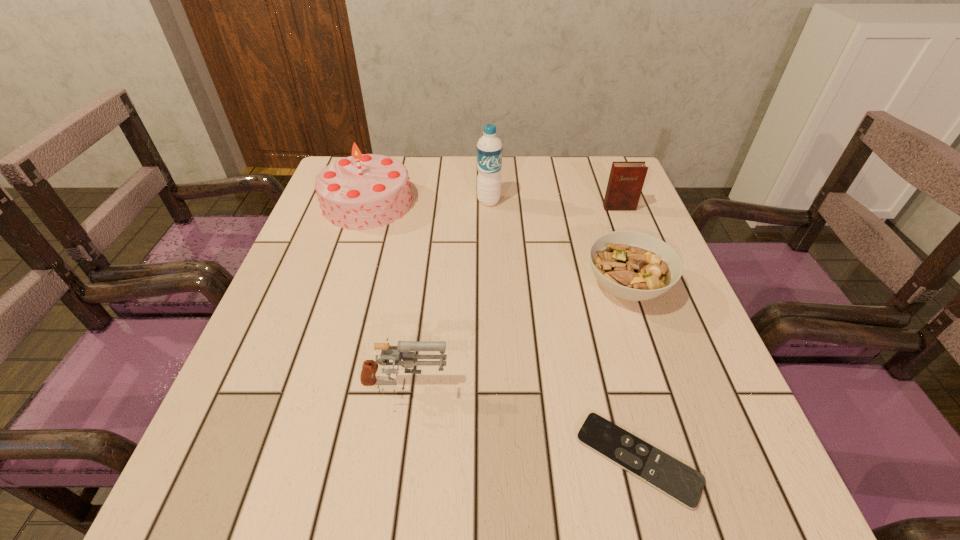
The image size is (960, 540). What are the coordinates of `free spot that satisfies the following two spatial constraints: 1. on the front side of the fourth farthest object; 2. at the barrel end of the third shortest object` in the screenshot? It's located at (660, 388).

At what (x,y) coordinates should I click in order to perform the action: click on free point that satisfies the following two spatial constraints: 1. on the label of the stew; 2. on the left side of the water bottle. Please return your answer as a coordinate pair (x, y). Looking at the image, I should click on click(491, 287).

Where is `vacant space that satisfies the following two spatial constraints: 1. on the front side of the third nearest object; 2. on the right side of the fifth shortest object`? vacant space that satisfies the following two spatial constraints: 1. on the front side of the third nearest object; 2. on the right side of the fifth shortest object is located at coordinates (341, 287).

Locate an element on the screen. free point that satisfies the following two spatial constraints: 1. on the front side of the fifth shortest object; 2. on the left side of the fourth farthest object is located at coordinates (341, 287).

This screenshot has width=960, height=540. Find the location of `free location that satisfies the following two spatial constraints: 1. at the barrel end of the gun; 2. on the back side of the nearest object`. free location that satisfies the following two spatial constraints: 1. at the barrel end of the gun; 2. on the back side of the nearest object is located at coordinates (395, 459).

Find the location of `free space in the image that satisfies the following two spatial constraints: 1. on the label of the water bottle; 2. at the barrel end of the fifth farthest object`. free space in the image that satisfies the following two spatial constraints: 1. on the label of the water bottle; 2. at the barrel end of the fifth farthest object is located at coordinates (493, 388).